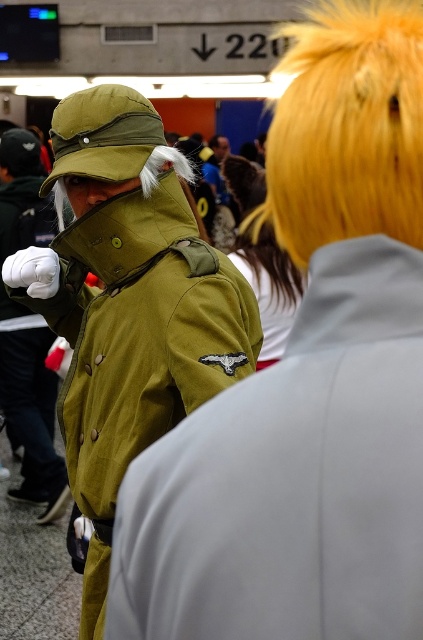
Which is in front, point (88, 96) or point (7, 348)?

Point (88, 96) is in front.

The height and width of the screenshot is (640, 423). What do you see at coordinates (128, 304) in the screenshot?
I see `matte green jacket at left` at bounding box center [128, 304].

You are a GUI agent. You are given a task and a screenshot of the screen. Output one action in this format:
    pyautogui.click(x=<x>, y=<y>)
    Task: Click on the matte green jacket at left
    
    Given the screenshot: What is the action you would take?
    pyautogui.click(x=128, y=304)

Which is in front, point (414, 243) or point (38, 355)?

Positioned in front is point (414, 243).

Is point (353, 230) closer to viewer compared to point (29, 364)?

Yes, point (353, 230) is in front of point (29, 364).

Where is `shiny golden wig at upper right`? This screenshot has width=423, height=640. shiny golden wig at upper right is located at coordinates (346, 129).

Is matte green jacket at left to the right of shiny golden wig at upper right from the viewer's perspective?

Incorrect, matte green jacket at left is not on the right side of shiny golden wig at upper right.

In the scene shown: Between matte green jacket at left and shiny golden wig at upper right, which one has more height?

Standing taller between the two is matte green jacket at left.

Locate an element on the screen. matte green jacket at left is located at coordinates (128, 304).